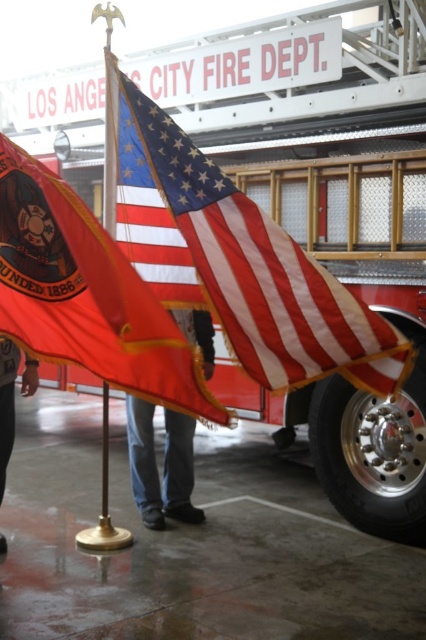
Question: Can you confirm if american flag at center is positioned to the left of matte red flag at center?

Choices:
 (A) yes
 (B) no

Answer: (B)

Question: Which object is farther from the camera taking this photo?

Choices:
 (A) american flag at center
 (B) jeans at center
 (C) matte red flag at center

Answer: (B)

Question: Can you confirm if american flag at center is wider than jeans at center?

Choices:
 (A) yes
 (B) no

Answer: (A)

Question: Which point appears farthest from the camera in this image?

Choices:
 (A) (49, 280)
 (B) (206, 241)

Answer: (B)

Question: Among these objects, which one is nearest to the camera?

Choices:
 (A) jeans at center
 (B) american flag at center
 (C) matte red flag at center

Answer: (C)

Question: Is american flag at center smaller than matte red flag at center?

Choices:
 (A) yes
 (B) no

Answer: (B)